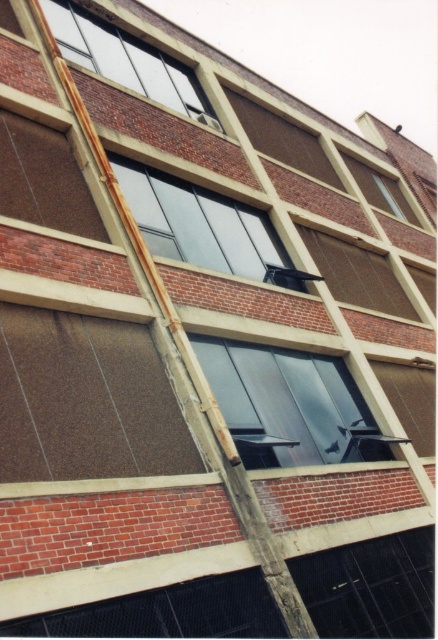
You are a window installer assessing the building. You need to replace both the matte black window at center and the transparent glass window at center. Which window requires a wider replacement frame?

The transparent glass window at center requires a wider replacement frame because its width is greater than the matte black window at center.

You are an architect reviewing a building facade. You need to install a new security camera on the smaller window. Which window should you choose between the matte black window at center and the clear glass window at upper center?

The clear glass window at upper center is the smaller one, so you should install the security camera there.